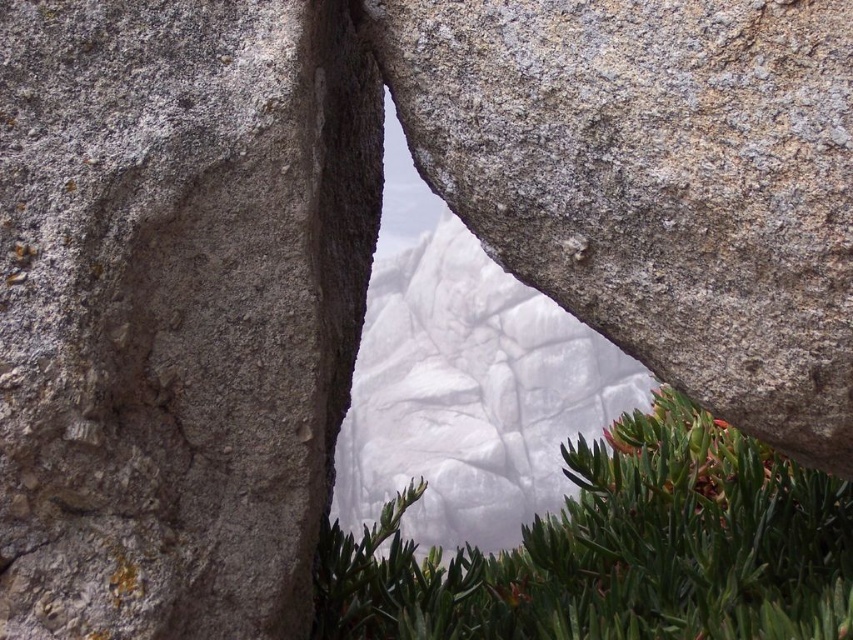
Question: Is gray rough rock at left thinner than gray rough boulder at center?

Choices:
 (A) no
 (B) yes

Answer: (B)

Question: Among these objects, which one is nearest to the camera?

Choices:
 (A) gray rough rock at left
 (B) gray rough boulder at center

Answer: (A)

Question: Which point appears farthest from the camera in this image?

Choices:
 (A) (440, 141)
 (B) (357, 16)

Answer: (B)

Question: Is gray rough rock at left below green leafy plant at center?

Choices:
 (A) yes
 (B) no

Answer: (B)

Question: Which point is farther to the camera?

Choices:
 (A) green leafy plant at center
 (B) gray rough rock at left

Answer: (A)

Question: Can you confirm if gray rough boulder at center is smaller than green leafy plant at center?

Choices:
 (A) yes
 (B) no

Answer: (A)